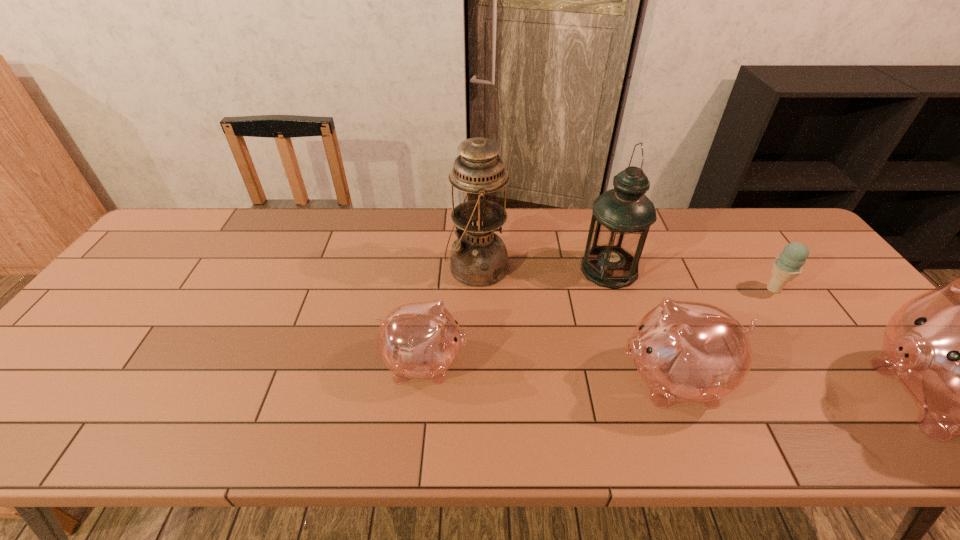
What are the coordinates of `free space located on the front of the left oil lamp` in the screenshot? It's located at (476, 354).

At what (x,y) coordinates should I click in order to perform the action: click on vacant area situated on the right of the right oil lamp. Please return your answer as a coordinate pair (x, y). Looking at the image, I should click on (682, 269).

Locate an element on the screen. vacant region located 0.080m on the left of the ice cream is located at coordinates (732, 289).

Locate an element on the screen. blank area at the far edge is located at coordinates (522, 226).

In the image, there is a desktop. Where is `vacant space at the near edge`? vacant space at the near edge is located at coordinates (521, 374).

I want to click on vacant region at the left edge of the desktop, so click(x=176, y=267).

This screenshot has height=540, width=960. I want to click on vacant space at the right edge, so click(x=844, y=290).

In the image, there is a desktop. Where is `free space at the far right corner`? The image size is (960, 540). free space at the far right corner is located at coordinates (743, 210).

The width and height of the screenshot is (960, 540). I want to click on blank region between the leftmost piggy bank and the ice cream, so 599,326.

Locate an element on the screen. The width and height of the screenshot is (960, 540). free space between the second piggy bank from right to left and the leftmost piggy bank is located at coordinates (548, 371).